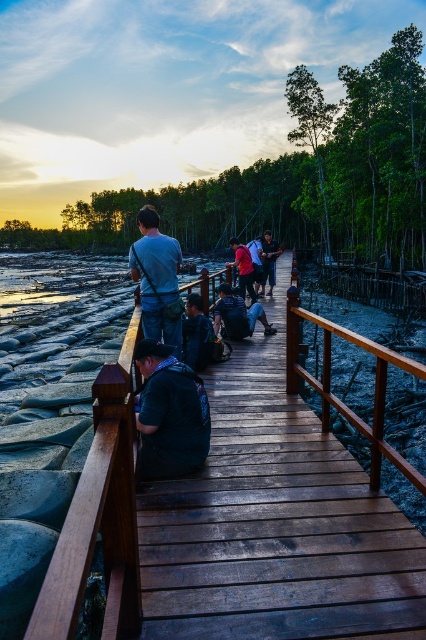
You are standing on the boardwalk and notice a matte red shirt at center and a matte black backpack at center. Which item appears narrower when viewed from your perspective?

The matte red shirt at center appears narrower than the matte black backpack at center.

You are a hiker who wants to take a photo of the sunset while carrying both the dark blue fabric shirt at center and the matte black backpack at center. Which item should you hold up higher to ensure both are visible in the photo?

Result: The dark blue fabric shirt at center has a smaller size compared to matte black backpack at center, so you should hold up the matte black backpack at center higher to ensure both items are visible in the photo.